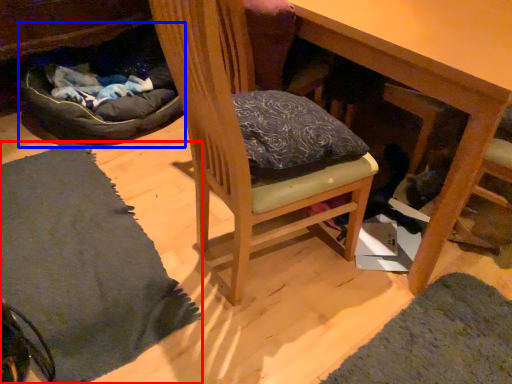
Question: Which object appears closest to the camera in this image, mat (highlighted by a red box) or bean bag chair (highlighted by a blue box)?

Choices:
 (A) mat
 (B) bean bag chair

Answer: (A)